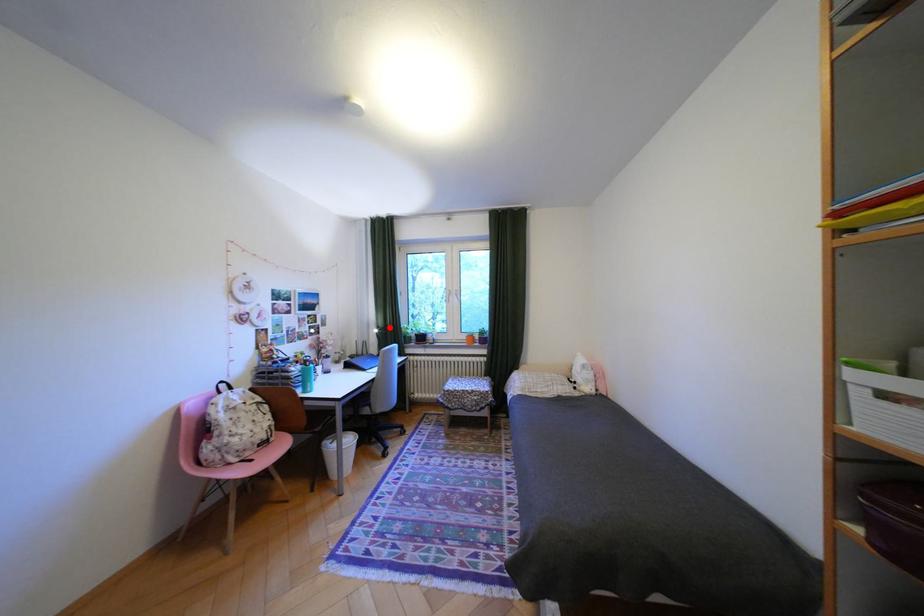
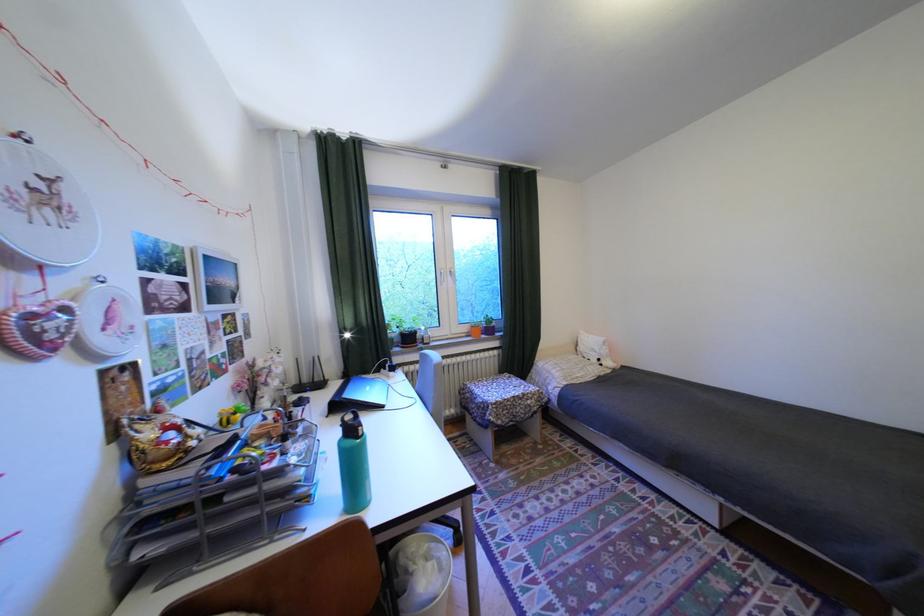
The point at the highlighted location is marked in the first image. Where is the corresponding point in the second image?

(354, 330)